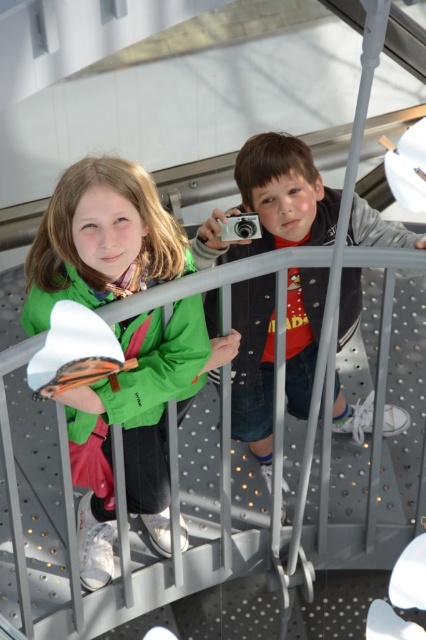
You are standing in front of the observation deck where the two children are. You notice two points marked on the platform. Which point is closer to you, point (80, 224) or point (287, 275)?

Point (80, 224) is closer to the viewer than point (287, 275).

You are a photographer trying to capture the two children on the platform. The girl is wearing a green matte jacket at left, and the boy is holding a camera at the right. To ensure both are in frame, where should you position your camera relative to the green matte jacket at upper left?

You should position your camera below the green matte jacket at upper left to include both the girl in the green matte jacket at left and the boy with the camera at the right in the frame, as the green matte jacket at left is located below the green matte jacket at upper left.